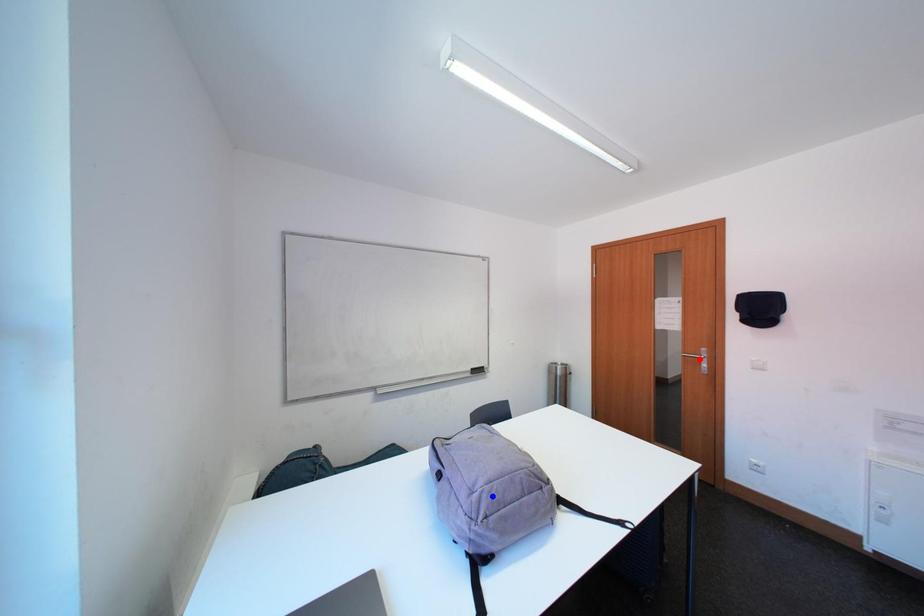
Question: Which of the two points in the image is closer to the camera?

Choices:
 (A) Blue point is closer.
 (B) Red point is closer.

Answer: (A)